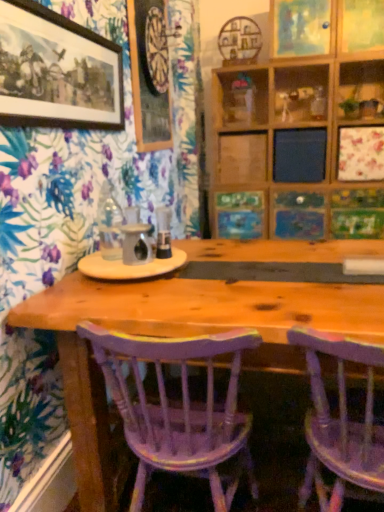
Find the location of a particular element. wooden painted picture frame at center, the 1th decorative picture in the bottom-to-top sequence is located at coordinates (240, 215).

At what (x,y) coordinates should I click in order to perform the action: click on wooden shelf at center. Please return your answer as a coordinate pair (x, y). The width and height of the screenshot is (384, 512). Looking at the image, I should click on coord(241,98).

What do you see at coordinates (241, 98) in the screenshot?
I see `wooden shelf at center` at bounding box center [241, 98].

The width and height of the screenshot is (384, 512). What are the coordinates of `matte black picture frame at upper left, the third picture frame when ordered from back to front` in the screenshot? It's located at (x=57, y=71).

The height and width of the screenshot is (512, 384). Identify the location of purple painted wood chair at center, arranged as the first chair when viewed from the left. (178, 408).

Does pastel painted picture at upper center, the first decorative picture viewed from the top, lie in front of wooden painted picture frame at center, the 1th decorative picture in the bottom-to-top sequence?

Yes.

Would you say pastel painted picture at upper center, the first decorative picture viewed from the top, contains wooden painted picture frame at center, the second decorative picture from the top?

No, wooden painted picture frame at center, the second decorative picture from the top, is located outside of pastel painted picture at upper center, the first decorative picture viewed from the top.

Consider the image. Which point is more distant from viewer, (308, 27) or (228, 226)?

Positioned behind is point (228, 226).

How different are the orientations of pastel painted picture at upper center, which is the 2th decorative picture from bottom to top, and wooden painted picture frame at center, the 1th decorative picture in the bottom-to-top sequence, in degrees?

2.36 degrees.

Between point (261, 222) and point (361, 350), which one is positioned in front?

The point (361, 350) is closer.

Is the surface of wooden painted picture frame at center, the second decorative picture from the top, in direct contact with purple painted wood chair at lower right, which appears as the 2th chair when viewed from the left?

No.

From a real-world perspective, is wooden painted picture frame at center, the second decorative picture from the top, physically below purple painted wood chair at lower right, which is counted as the first chair, starting from the right?

No, from a real-world perspective, wooden painted picture frame at center, the second decorative picture from the top, is not under purple painted wood chair at lower right, which is counted as the first chair, starting from the right.

In the image, is wooden painted picture frame at center, the 1th decorative picture in the bottom-to-top sequence, positioned in front of or behind purple painted wood chair at lower right, which is counted as the first chair, starting from the right?

Visually, wooden painted picture frame at center, the 1th decorative picture in the bottom-to-top sequence, is located behind purple painted wood chair at lower right, which is counted as the first chair, starting from the right.

Is wooden picture frame at upper right, placed as the 3th picture frame when sorted from left to right, taller than purple painted wood chair at center, placed as the 2th chair when sorted from right to left?

No, wooden picture frame at upper right, placed as the 3th picture frame when sorted from left to right, is not taller than purple painted wood chair at center, placed as the 2th chair when sorted from right to left.

Considering the relative positions of wooden picture frame at upper right, arranged as the third picture frame when viewed from the front, and purple painted wood chair at center, arranged as the first chair when viewed from the left, in the image provided, is wooden picture frame at upper right, arranged as the third picture frame when viewed from the front, to the right of purple painted wood chair at center, arranged as the first chair when viewed from the left, from the viewer's perspective?

Correct, you'll find wooden picture frame at upper right, arranged as the third picture frame when viewed from the front, to the right of purple painted wood chair at center, arranged as the first chair when viewed from the left.

Relative to purple painted wood chair at center, arranged as the first chair when viewed from the left, is wooden picture frame at upper right, which is counted as the 1th picture frame, starting from the back, in front or behind?

wooden picture frame at upper right, which is counted as the 1th picture frame, starting from the back, is behind purple painted wood chair at center, arranged as the first chair when viewed from the left.

Which point is more forward, [370,42] or [142,420]?

Point [142,420]

Does purple painted wood chair at center, placed as the 2th chair when sorted from right to left, turn towards wooden picture frame at upper center, arranged as the second picture frame when viewed from the back?

No, purple painted wood chair at center, placed as the 2th chair when sorted from right to left, does not turn towards wooden picture frame at upper center, arranged as the second picture frame when viewed from the back.

From a real-world perspective, is purple painted wood chair at center, arranged as the first chair when viewed from the left, above or below wooden picture frame at upper center, the second picture frame viewed from the left?

purple painted wood chair at center, arranged as the first chair when viewed from the left, is below wooden picture frame at upper center, the second picture frame viewed from the left.

Is point (129, 394) positioned in front of point (139, 66)?

Yes, point (129, 394) is closer to viewer.

Visually, is purple painted wood chair at center, arranged as the first chair when viewed from the left, positioned to the left or to the right of wooden picture frame at upper center, arranged as the 2th picture frame when viewed from the front?

Based on their positions, purple painted wood chair at center, arranged as the first chair when viewed from the left, is located to the right of wooden picture frame at upper center, arranged as the 2th picture frame when viewed from the front.

From a real-world perspective, between wooden painted picture frame at center, the second decorative picture from the top, and wooden picture frame at upper right, arranged as the third picture frame when viewed from the front, who is vertically lower?

wooden painted picture frame at center, the second decorative picture from the top, is physically lower.

Is wooden painted picture frame at center, the 1th decorative picture in the bottom-to-top sequence, bigger or smaller than wooden picture frame at upper right, arranged as the third picture frame when viewed from the front?

In the image, wooden painted picture frame at center, the 1th decorative picture in the bottom-to-top sequence, appears to be larger than wooden picture frame at upper right, arranged as the third picture frame when viewed from the front.

Which object is further away from the camera taking this photo, wooden painted picture frame at center, the second decorative picture from the top, or wooden picture frame at upper right, arranged as the first picture frame when viewed from the right?

wooden painted picture frame at center, the second decorative picture from the top, is further from the camera.

Based on the photo, is wooden painted picture frame at center, the second decorative picture from the top, placed right next to wooden picture frame at upper right, arranged as the first picture frame when viewed from the right?

No, wooden painted picture frame at center, the second decorative picture from the top, is not making contact with wooden picture frame at upper right, arranged as the first picture frame when viewed from the right.

From a real-world perspective, relative to wooden picture frame at upper center, the second picture frame viewed from the left, is matte black picture frame at upper left, the third picture frame when ordered from back to front, vertically above or below?

Clearly, from a real-world perspective, matte black picture frame at upper left, the third picture frame when ordered from back to front, is below wooden picture frame at upper center, the second picture frame viewed from the left.

From the image's perspective, would you say matte black picture frame at upper left, the 1th picture frame positioned from the left, is positioned over wooden picture frame at upper center, marked as the second picture frame in a right-to-left arrangement?

No, from the image's perspective, matte black picture frame at upper left, the 1th picture frame positioned from the left, is not over wooden picture frame at upper center, marked as the second picture frame in a right-to-left arrangement.

Is matte black picture frame at upper left, the third picture frame when ordered from back to front, situated inside wooden picture frame at upper center, arranged as the second picture frame when viewed from the back, or outside?

matte black picture frame at upper left, the third picture frame when ordered from back to front, lies outside wooden picture frame at upper center, arranged as the second picture frame when viewed from the back.

Which of these two, purple painted wood chair at lower right, which appears as the 2th chair when viewed from the left, or purple painted wood chair at center, placed as the 2th chair when sorted from right to left, stands taller?

purple painted wood chair at lower right, which appears as the 2th chair when viewed from the left, is taller.

From a real-world perspective, is purple painted wood chair at lower right, which is counted as the first chair, starting from the right, located beneath purple painted wood chair at center, placed as the 2th chair when sorted from right to left?

No, from a real-world perspective, purple painted wood chair at lower right, which is counted as the first chair, starting from the right, is not under purple painted wood chair at center, placed as the 2th chair when sorted from right to left.

From the image's perspective, relative to purple painted wood chair at center, placed as the 2th chair when sorted from right to left, is purple painted wood chair at lower right, which is counted as the first chair, starting from the right, above or below?

purple painted wood chair at lower right, which is counted as the first chair, starting from the right, is situated higher than purple painted wood chair at center, placed as the 2th chair when sorted from right to left, in the image.

Is purple painted wood chair at lower right, which is counted as the first chair, starting from the right, bigger or smaller than purple painted wood chair at center, arranged as the first chair when viewed from the left?

purple painted wood chair at lower right, which is counted as the first chair, starting from the right, is smaller than purple painted wood chair at center, arranged as the first chair when viewed from the left.

I want to click on decorative picture located in front of the wooden painted picture frame at center, the 1th decorative picture in the bottom-to-top sequence, so click(x=300, y=28).

Locate an element on the screen. the 1st chair below the wooden painted picture frame at center, the 1th decorative picture in the bottom-to-top sequence (from the image's perspective) is located at coordinates (340, 422).

Looking at the image, which one is located closer to pastel painted picture at upper center, which is the 2th decorative picture from bottom to top, purple painted wood chair at center, arranged as the first chair when viewed from the left, or matte black picture frame at upper left, the 1th picture frame positioned from the left?

matte black picture frame at upper left, the 1th picture frame positioned from the left, lies closer to pastel painted picture at upper center, which is the 2th decorative picture from bottom to top, than the other object.

When comparing their distances from wooden picture frame at upper right, arranged as the first picture frame when viewed from the right, does purple painted wood chair at lower right, which is counted as the first chair, starting from the right, or wooden painted picture frame at center, the 1th decorative picture in the bottom-to-top sequence, seem closer?

wooden painted picture frame at center, the 1th decorative picture in the bottom-to-top sequence, lies closer to wooden picture frame at upper right, arranged as the first picture frame when viewed from the right, than the other object.

From the image, which object appears to be farther from wooden shelf at center, wooden painted picture frame at center, the 1th decorative picture in the bottom-to-top sequence, or purple painted wood chair at lower right, which appears as the 2th chair when viewed from the left?

purple painted wood chair at lower right, which appears as the 2th chair when viewed from the left, is positioned further to the anchor wooden shelf at center.

When comparing their distances from matte black picture frame at upper left, which is the 1th picture frame from front to back, does pastel painted picture at upper center, the first decorative picture viewed from the top, or wooden picture frame at upper right, which is counted as the 1th picture frame, starting from the back, seem further?

Among the two, wooden picture frame at upper right, which is counted as the 1th picture frame, starting from the back, is located further to matte black picture frame at upper left, which is the 1th picture frame from front to back.

Considering their positions, is wooden picture frame at upper center, arranged as the second picture frame when viewed from the back, positioned further to wooden shelf at center than wooden painted picture frame at center, the 1th decorative picture in the bottom-to-top sequence?

wooden picture frame at upper center, arranged as the second picture frame when viewed from the back.

When comparing their distances from matte black picture frame at upper left, the 1th picture frame positioned from the left, does purple painted wood chair at center, placed as the 2th chair when sorted from right to left, or wooden painted picture frame at center, the 1th decorative picture in the bottom-to-top sequence, seem further?

wooden painted picture frame at center, the 1th decorative picture in the bottom-to-top sequence.

Looking at the image, which one is located closer to wooden picture frame at upper center, marked as the second picture frame in a right-to-left arrangement, matte black picture frame at upper left, the 1th picture frame positioned from the left, or wooden painted picture frame at center, the 1th decorative picture in the bottom-to-top sequence?

matte black picture frame at upper left, the 1th picture frame positioned from the left, lies closer to wooden picture frame at upper center, marked as the second picture frame in a right-to-left arrangement, than the other object.

Based on their spatial positions, is wooden shelf at center or wooden painted picture frame at center, the second decorative picture from the top, further from wooden picture frame at upper center, the second picture frame viewed from the left?

Among the two, wooden painted picture frame at center, the second decorative picture from the top, is located further to wooden picture frame at upper center, the second picture frame viewed from the left.

You are a GUI agent. You are given a task and a screenshot of the screen. Output one action in this format:
    pyautogui.click(x=<x>, y=<y>)
    Task: Click on the shelf between purple painted wood chair at center, arranged as the first chair when viewed from the left, and wooden painted picture frame at center, the 1th decorative picture in the bottom-to-top sequence, in the front-back direction
    This screenshot has height=512, width=384.
    Given the screenshot: What is the action you would take?
    pyautogui.click(x=241, y=98)

This screenshot has height=512, width=384. I want to click on shelf between wooden picture frame at upper center, marked as the second picture frame in a right-to-left arrangement, and wooden picture frame at upper right, placed as the 3th picture frame when sorted from left to right, in the horizontal direction, so click(241, 98).

At what (x,y) coordinates should I click in order to perform the action: click on chair between purple painted wood chair at lower right, which appears as the 2th chair when viewed from the left, and wooden shelf at center, along the z-axis. Please return your answer as a coordinate pair (x, y). Looking at the image, I should click on (178, 408).

Identify the location of shelf between pastel painted picture at upper center, the first decorative picture viewed from the top, and purple painted wood chair at center, placed as the 2th chair when sorted from right to left, vertically. The height and width of the screenshot is (512, 384). (241, 98).